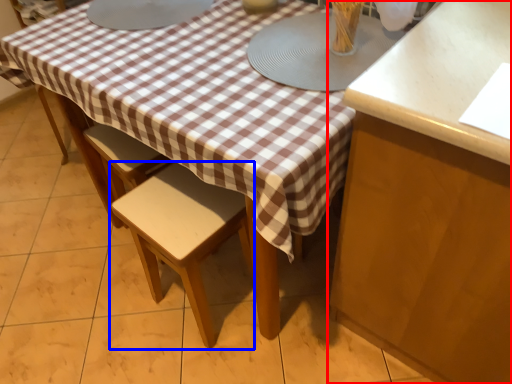
Question: Which of the following is the closest to the observer, cabinetry (highlighted by a red box) or stool (highlighted by a blue box)?

Choices:
 (A) cabinetry
 (B) stool

Answer: (A)